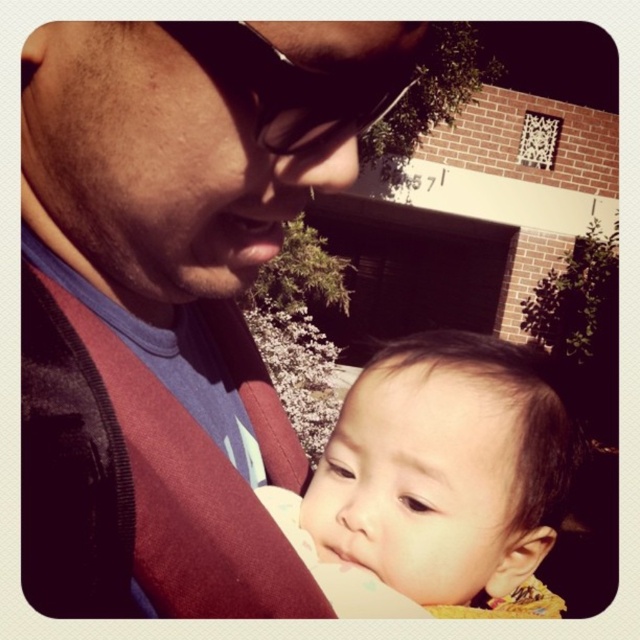
Question: Does matte blue shirt at center appear on the right side of smooth skin baby at center?

Choices:
 (A) no
 (B) yes

Answer: (A)

Question: Does matte blue shirt at center have a larger size compared to smooth skin baby at center?

Choices:
 (A) yes
 (B) no

Answer: (A)

Question: Can you confirm if matte blue shirt at center is positioned to the right of smooth skin baby at center?

Choices:
 (A) yes
 (B) no

Answer: (B)

Question: Which point is farther to the camera?

Choices:
 (A) smooth skin baby at center
 (B) matte blue shirt at center

Answer: (A)

Question: Which point is closer to the camera?

Choices:
 (A) matte blue shirt at center
 (B) smooth skin baby at center

Answer: (A)